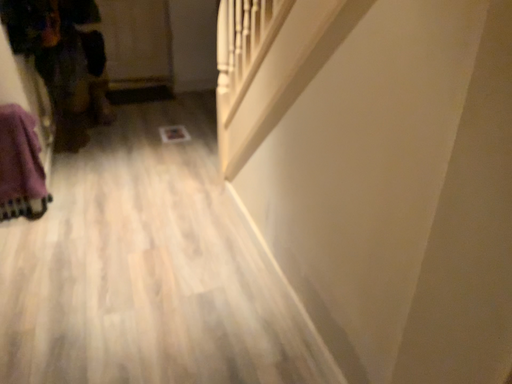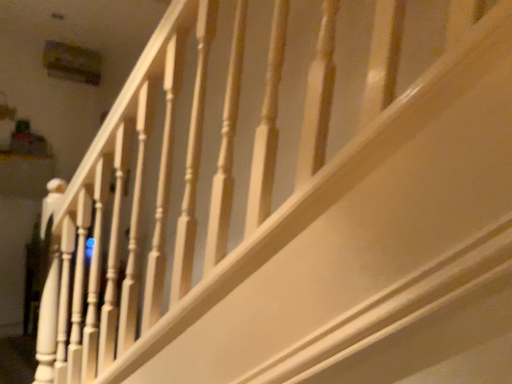
Question: Which way did the camera rotate in the video?

Choices:
 (A) rotated upward
 (B) rotated downward

Answer: (A)